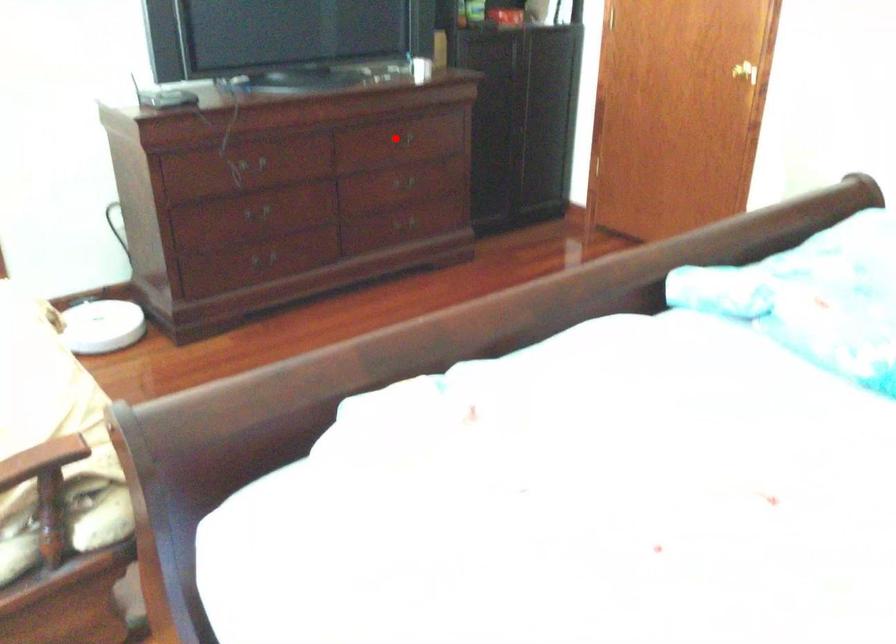
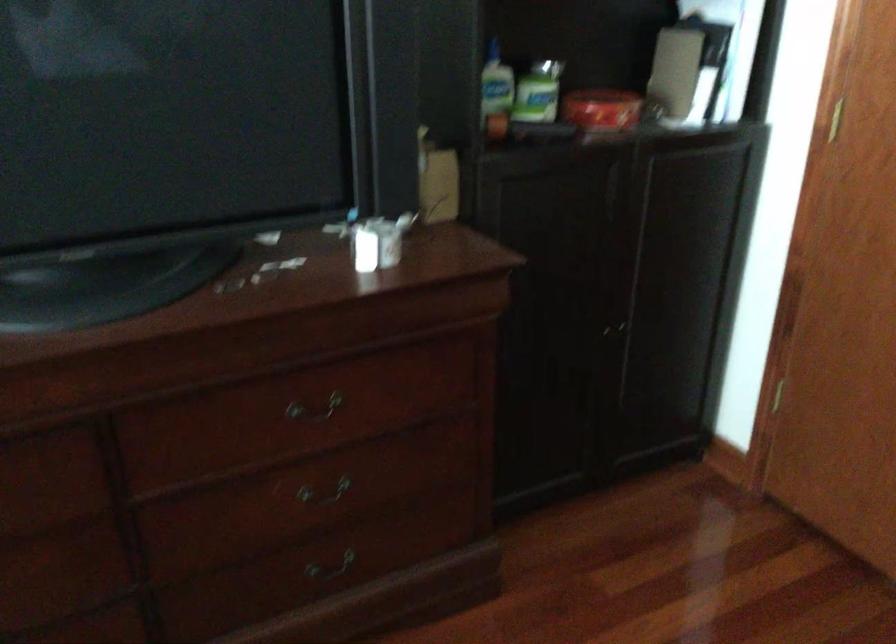
Question: I am providing you with two images of the same scene from different viewpoints. In image1, a red point is highlighted. Considering the same 3D point in image2, which of the following is correct?

Choices:
 (A) It is closer
 (B) It is farther

Answer: (A)